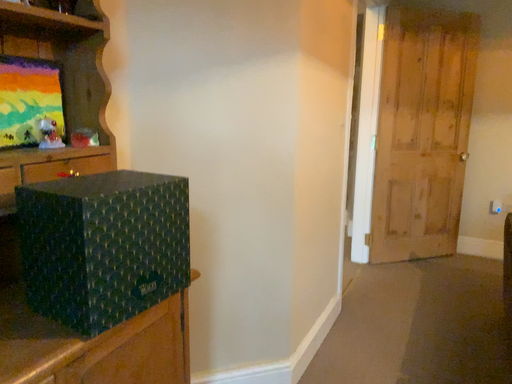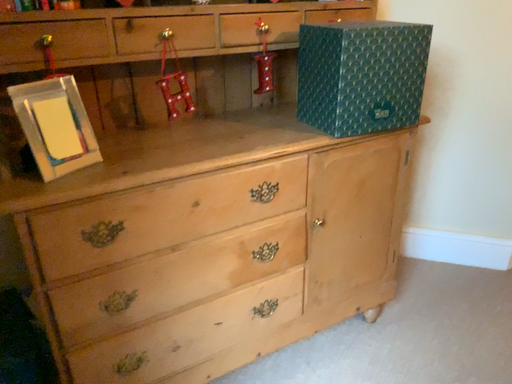
Question: Which way did the camera rotate in the video?

Choices:
 (A) rotated right
 (B) rotated left

Answer: (B)